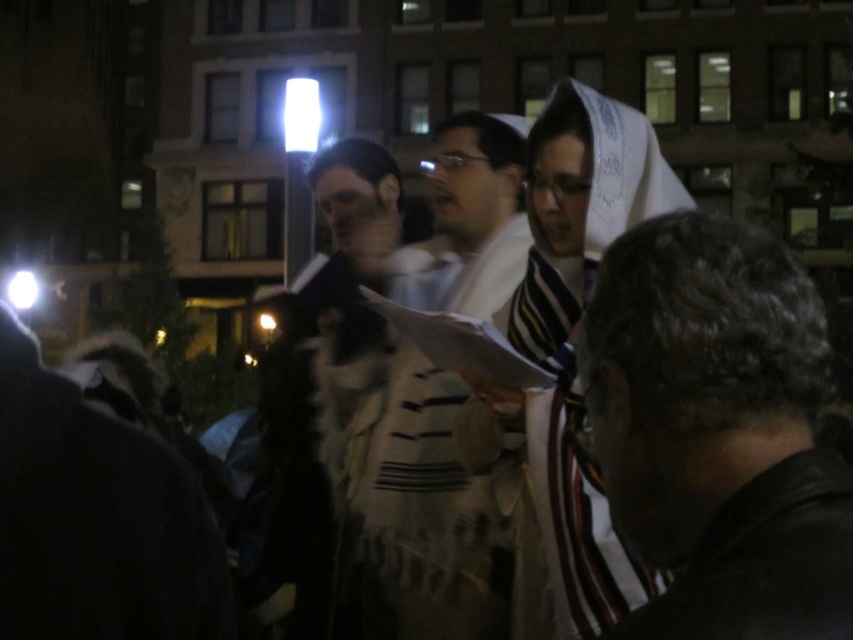
Question: Which point is closer to the camera?

Choices:
 (A) white fur coat at center
 (B) white textured shawl at center
 (C) dark brown leather jacket at lower right

Answer: (C)

Question: Can you confirm if dark brown leather jacket at lower right is wider than white textured shawl at center?

Choices:
 (A) yes
 (B) no

Answer: (B)

Question: Can you confirm if white textured scarf at center is positioned above striped woolen shawl at center?

Choices:
 (A) yes
 (B) no

Answer: (A)

Question: Among these objects, which one is farthest from the camera?

Choices:
 (A) white textured shawl at center
 (B) white textured scarf at center

Answer: (A)

Question: Which point is closer to the camera taking this photo?

Choices:
 (A) (421, 390)
 (B) (769, 604)
 (C) (604, 512)
 (D) (532, 323)

Answer: (B)

Question: Can you confirm if white textured shawl at center is bigger than striped fabric robe at lower right?

Choices:
 (A) no
 (B) yes

Answer: (B)